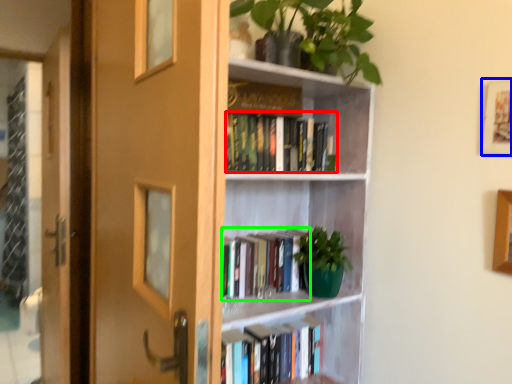
Question: Which object is positioned closest to book (highlighted by a red box)? Select from picture frame (highlighted by a blue box) and book (highlighted by a green box).

Choices:
 (A) picture frame
 (B) book

Answer: (B)